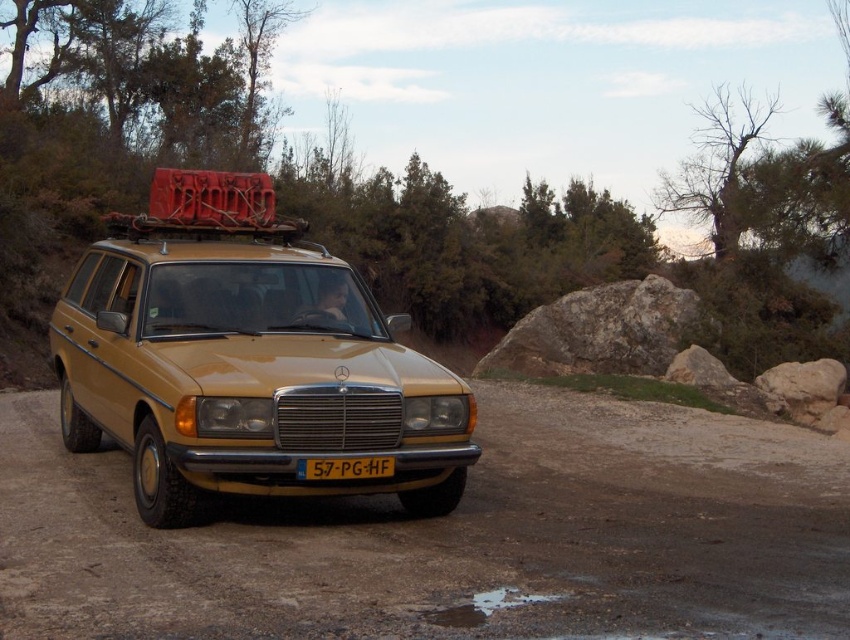
Question: Which object is positioned closest to the dull yellow dirt track at center?

Choices:
 (A) matte yellow car at center
 (B) yellow matte license plate at center

Answer: (A)

Question: Does dull yellow dirt track at center have a greater width compared to matte yellow car at center?

Choices:
 (A) yes
 (B) no

Answer: (B)

Question: Considering the relative positions of matte yellow car at center and yellow matte license plate at center in the image provided, where is matte yellow car at center located with respect to yellow matte license plate at center?

Choices:
 (A) right
 (B) left

Answer: (B)

Question: Which object appears farthest from the camera in this image?

Choices:
 (A) yellow matte license plate at center
 (B) dull yellow dirt track at center
 (C) matte yellow car at center

Answer: (B)

Question: Can you confirm if dull yellow dirt track at center is positioned below yellow matte license plate at center?

Choices:
 (A) yes
 (B) no

Answer: (A)

Question: Which object appears closest to the camera in this image?

Choices:
 (A) yellow matte license plate at center
 (B) matte yellow car at center

Answer: (B)